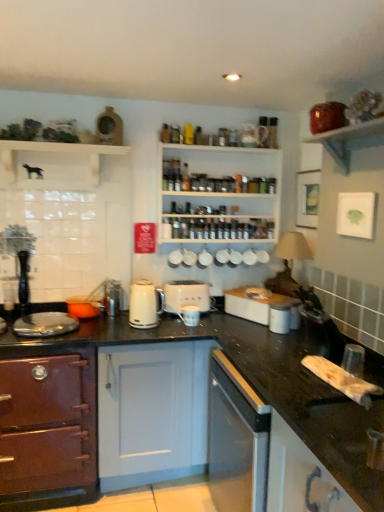
Question: Can you see white matte dog at upper left, arranged as the second shelf when viewed from the front, touching matte purple oven at lower left, the 1th cabinetry viewed from the left?

Choices:
 (A) yes
 (B) no

Answer: (B)

Question: Can you confirm if white matte dog at upper left, arranged as the second shelf when viewed from the front, is taller than matte purple oven at lower left, the 1th cabinetry viewed from the left?

Choices:
 (A) yes
 (B) no

Answer: (B)

Question: Is the depth of white matte dog at upper left, the second shelf viewed from the back, greater than that of matte purple oven at lower left, which ranks as the second cabinetry in front-to-back order?

Choices:
 (A) no
 (B) yes

Answer: (B)

Question: Is white matte dog at upper left, placed as the third shelf when sorted from right to left, not close to matte purple oven at lower left, which appears as the second cabinetry when viewed from the right?

Choices:
 (A) no
 (B) yes

Answer: (B)

Question: Does white matte dog at upper left, which is the first shelf from left to right, lie in front of matte purple oven at lower left, which ranks as the second cabinetry in front-to-back order?

Choices:
 (A) no
 (B) yes

Answer: (A)

Question: In terms of height, does white glossy kettle at center look taller or shorter compared to matte purple oven at lower left, the first cabinetry when ordered from back to front?

Choices:
 (A) tall
 (B) short

Answer: (B)

Question: Is white glossy kettle at center inside the boundaries of matte purple oven at lower left, which ranks as the second cabinetry in front-to-back order, or outside?

Choices:
 (A) outside
 (B) inside

Answer: (A)

Question: Based on their sizes in the image, would you say white glossy kettle at center is bigger or smaller than matte purple oven at lower left, which ranks as the second cabinetry in front-to-back order?

Choices:
 (A) small
 (B) big

Answer: (A)

Question: From a real-world perspective, relative to matte purple oven at lower left, the 1th cabinetry viewed from the left, is white glossy kettle at center vertically above or below?

Choices:
 (A) below
 (B) above

Answer: (B)

Question: Does point (185, 323) appear closer or farther from the camera than point (248, 308)?

Choices:
 (A) farther
 (B) closer

Answer: (B)

Question: Is porcelain matte mug at center, acting as the 2th appliance starting from the right, in front of or behind white glossy toaster at center, the 4th appliance from the left, in the image?

Choices:
 (A) front
 (B) behind

Answer: (A)

Question: Looking at the image, does porcelain matte mug at center, acting as the 2th appliance starting from the right, seem bigger or smaller compared to white glossy toaster at center, arranged as the 1th appliance when viewed from the right?

Choices:
 (A) small
 (B) big

Answer: (A)

Question: Visually, is porcelain matte mug at center, acting as the 2th appliance starting from the right, positioned to the left or to the right of white glossy toaster at center, the 4th appliance from the left?

Choices:
 (A) left
 (B) right

Answer: (A)

Question: In terms of size, does white glossy cabinet at lower right, the 1th cabinetry in the right-to-left sequence, appear bigger or smaller than matte brown bowl at upper right, which appears as the 3th shelf when viewed from the left?

Choices:
 (A) small
 (B) big

Answer: (B)

Question: Considering the positions of white glossy cabinet at lower right, which appears as the 2th cabinetry when viewed from the back, and matte brown bowl at upper right, which is the 3th shelf in back-to-front order, in the image, is white glossy cabinet at lower right, which appears as the 2th cabinetry when viewed from the back, taller or shorter than matte brown bowl at upper right, which is the 3th shelf in back-to-front order,?

Choices:
 (A) short
 (B) tall

Answer: (B)